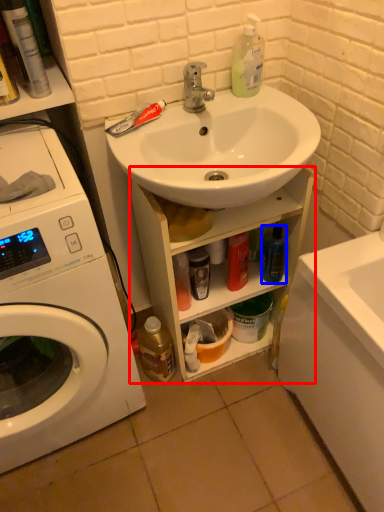
Question: Which object appears closest to the camera in this image, bathroom cabinet (highlighted by a red box) or bottle (highlighted by a blue box)?

Choices:
 (A) bathroom cabinet
 (B) bottle

Answer: (A)